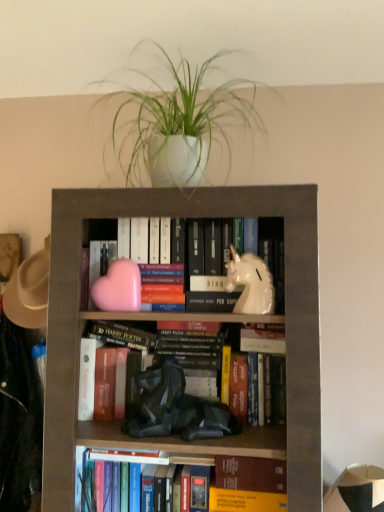
Question: Is matte gray bookcase at center touching white glossy unicorn at center-right, marked as the 1th animal in a right-to-left arrangement?

Choices:
 (A) yes
 (B) no

Answer: (B)

Question: Is matte gray bookcase at center oriented towards white glossy unicorn at center-right, marked as the 1th animal in a right-to-left arrangement?

Choices:
 (A) yes
 (B) no

Answer: (A)

Question: Is matte gray bookcase at center at the right side of white glossy unicorn at center-right, marked as the 1th animal in a right-to-left arrangement?

Choices:
 (A) no
 (B) yes

Answer: (A)

Question: Is matte gray bookcase at center taller than white glossy unicorn at center-right, the 2th animal in the left-to-right sequence?

Choices:
 (A) yes
 (B) no

Answer: (A)

Question: From a real-world perspective, is matte gray bookcase at center below white glossy unicorn at center-right, marked as the 1th animal in a right-to-left arrangement?

Choices:
 (A) no
 (B) yes

Answer: (B)

Question: Is hardcover book at lower center taller or shorter than hardcover book at center?

Choices:
 (A) tall
 (B) short

Answer: (A)

Question: Based on their sizes in the image, would you say hardcover book at lower center is bigger or smaller than hardcover book at center?

Choices:
 (A) big
 (B) small

Answer: (B)

Question: Does point (246, 484) appear closer or farther from the camera than point (201, 460)?

Choices:
 (A) closer
 (B) farther

Answer: (A)

Question: Is hardcover book at lower center situated inside hardcover book at center or outside?

Choices:
 (A) outside
 (B) inside

Answer: (A)

Question: Based on their positions, is matte gray bookcase at center located to the left or right of hardcover book at lower center?

Choices:
 (A) left
 (B) right

Answer: (A)

Question: Considering the positions of matte gray bookcase at center and hardcover book at lower center in the image, is matte gray bookcase at center taller or shorter than hardcover book at lower center?

Choices:
 (A) tall
 (B) short

Answer: (A)

Question: Relative to hardcover book at lower center, is matte gray bookcase at center in front or behind?

Choices:
 (A) behind
 (B) front

Answer: (B)

Question: From the image's perspective, relative to hardcover book at lower center, is matte gray bookcase at center above or below?

Choices:
 (A) below
 (B) above

Answer: (B)

Question: From a real-world perspective, is hardcover book at lower center positioned above or below pink matte heart at center, acting as the 1th animal starting from the left?

Choices:
 (A) below
 (B) above

Answer: (A)

Question: Based on their sizes in the image, would you say hardcover book at lower center is bigger or smaller than pink matte heart at center, acting as the 1th animal starting from the left?

Choices:
 (A) big
 (B) small

Answer: (A)